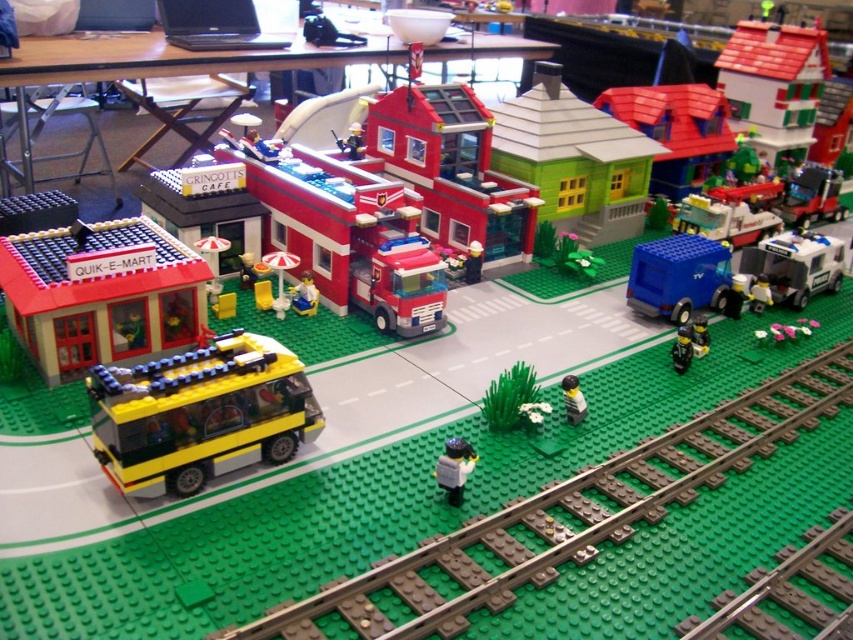
You are a Lego figure trying to wave to the translucent gray figure at center from the smooth plastic minifigure at center. Can you see them clearly?

The translucent gray figure at center is in front of the smooth plastic minifigure at center, so the smooth plastic minifigure at center might have an obstructed view and may not be able to see them clearly.